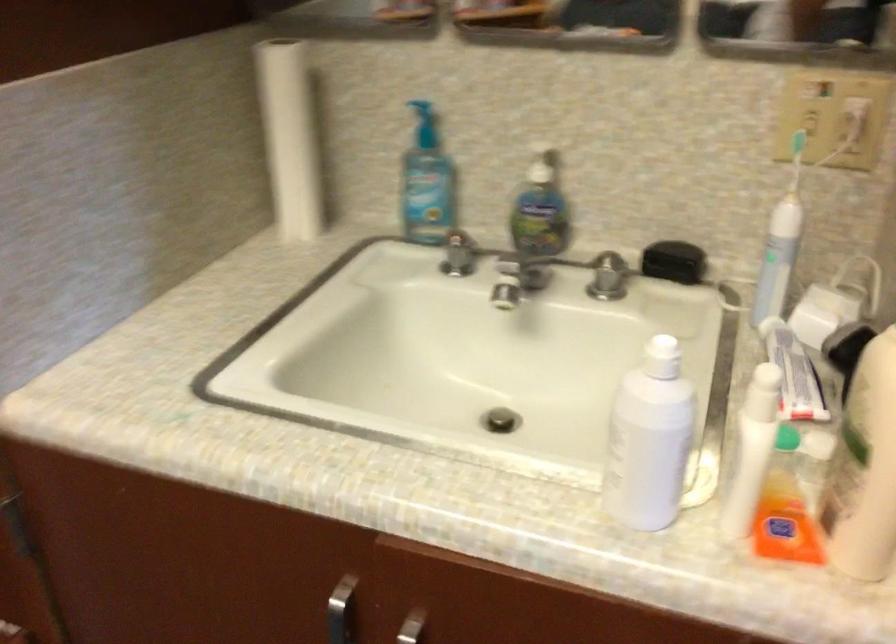
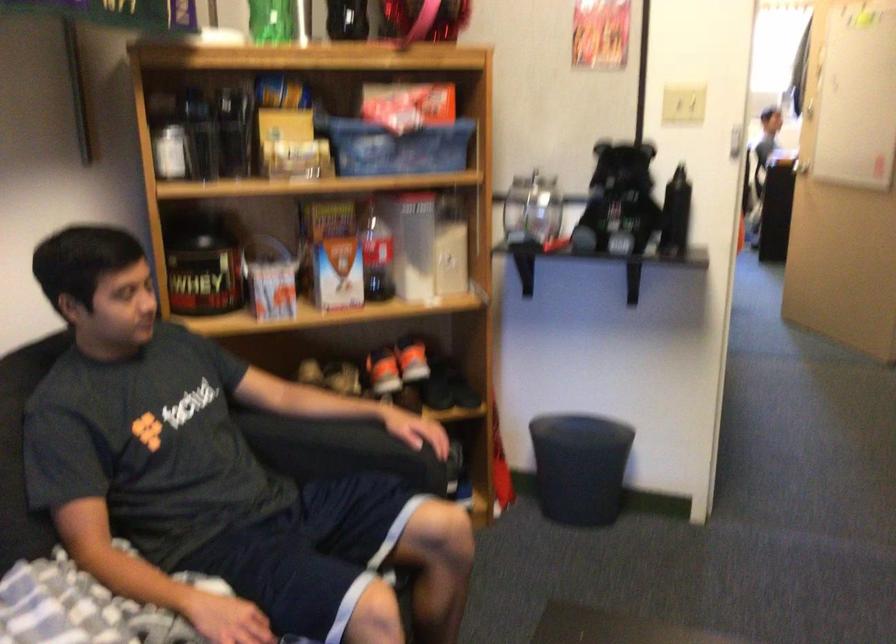
Question: Based on the continuous images, in which direction is the camera rotating? Reply with the corresponding letter.

Choices:
 (A) Left
 (B) Right
 (C) Up
 (D) Down

Answer: (A)